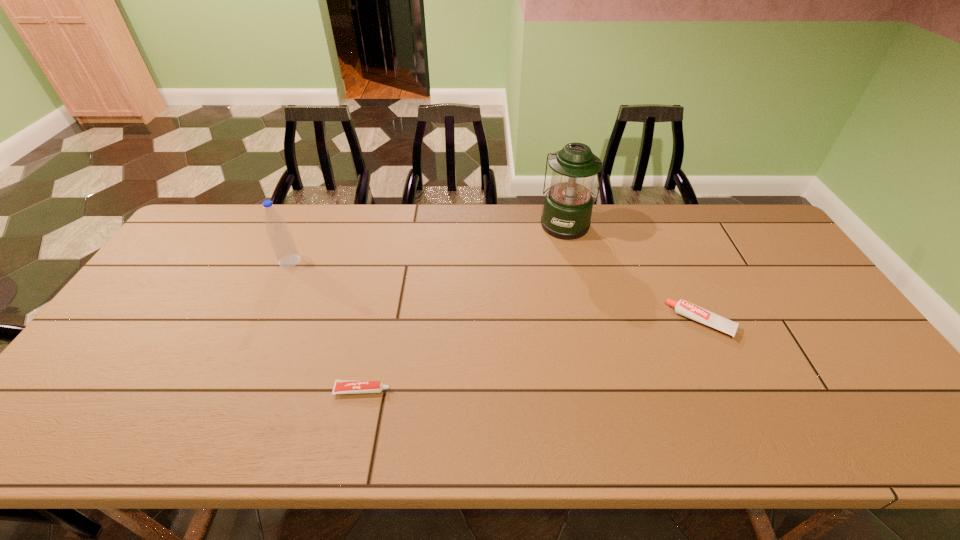
At what (x,y) coordinates should I click in order to perform the action: click on vacant point located on the back of the taller toothpaste. Please return your answer as a coordinate pair (x, y). This screenshot has height=540, width=960. Looking at the image, I should click on (672, 259).

This screenshot has height=540, width=960. Identify the location of vacant space situated 0.370m at the nozzle of the shorter toothpaste. (546, 390).

You are a GUI agent. You are given a task and a screenshot of the screen. Output one action in this format:
    pyautogui.click(x=<x>, y=<y>)
    Task: Click on the object that is at the far edge
    
    Given the screenshot: What is the action you would take?
    pyautogui.click(x=567, y=211)

The width and height of the screenshot is (960, 540). I want to click on free space at the far edge of the desktop, so click(399, 227).

In the image, there is a desktop. Identify the location of vacant space at the near edge. Image resolution: width=960 pixels, height=540 pixels. (468, 449).

Find the location of `vacant space at the left edge of the desktop`. vacant space at the left edge of the desktop is located at coordinates (96, 374).

Locate an element on the screen. The image size is (960, 540). blank space at the right edge of the desktop is located at coordinates (768, 295).

You are a GUI agent. You are given a task and a screenshot of the screen. Output one action in this format:
    pyautogui.click(x=<x>, y=<y>)
    Task: Click on the vacant space at the far left corner
    
    Given the screenshot: What is the action you would take?
    pyautogui.click(x=221, y=208)

At what (x,y) coordinates should I click in order to perform the action: click on vacant space at the near left corner of the desktop. Please return your answer as a coordinate pair (x, y). Looking at the image, I should click on (71, 415).

The width and height of the screenshot is (960, 540). In the image, there is a desktop. Find the location of `vacant space at the far right corner`. vacant space at the far right corner is located at coordinates (756, 246).